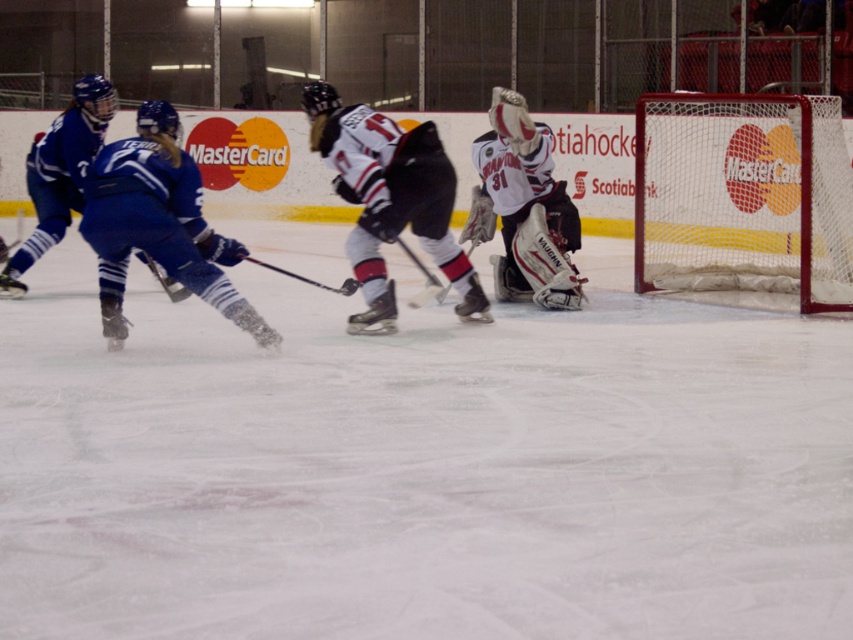
Question: From the image, what is the correct spatial relationship of matte black hockey stick at left in relation to metallic silver hockey stick at center?

Choices:
 (A) right
 (B) left

Answer: (B)

Question: Which of the following is the closest to the observer?

Choices:
 (A) (178, 291)
 (B) (271, 266)

Answer: (B)

Question: Is matte black hockey stick at left thinner than metallic silver hockey stick at center?

Choices:
 (A) yes
 (B) no

Answer: (A)

Question: Can you confirm if matte black hockey stick at left is positioned to the right of metallic silver hockey stick at center?

Choices:
 (A) no
 (B) yes

Answer: (A)